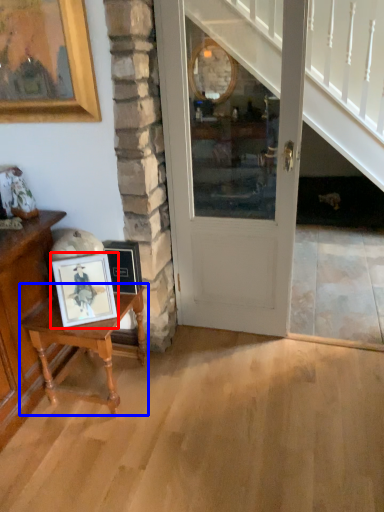
Question: Which of the following is the closest to the observer, picture frame (highlighted by a red box) or table (highlighted by a blue box)?

Choices:
 (A) picture frame
 (B) table

Answer: (A)